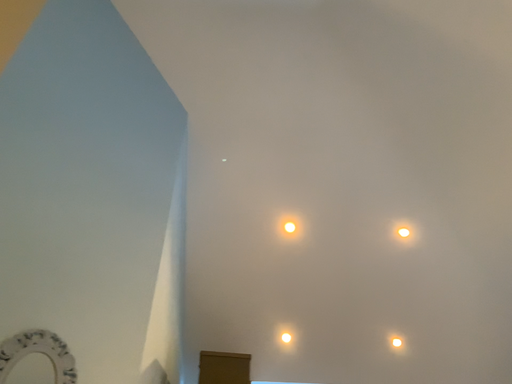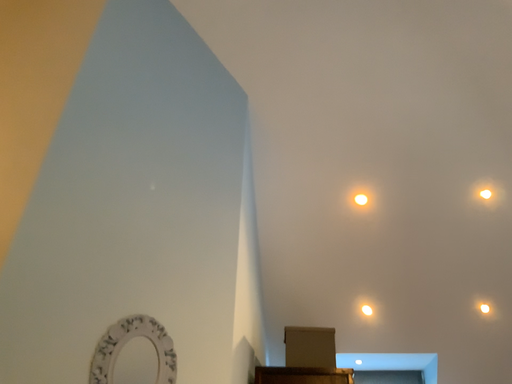
Question: Which way did the camera rotate in the video?

Choices:
 (A) rotated right
 (B) rotated left

Answer: (B)